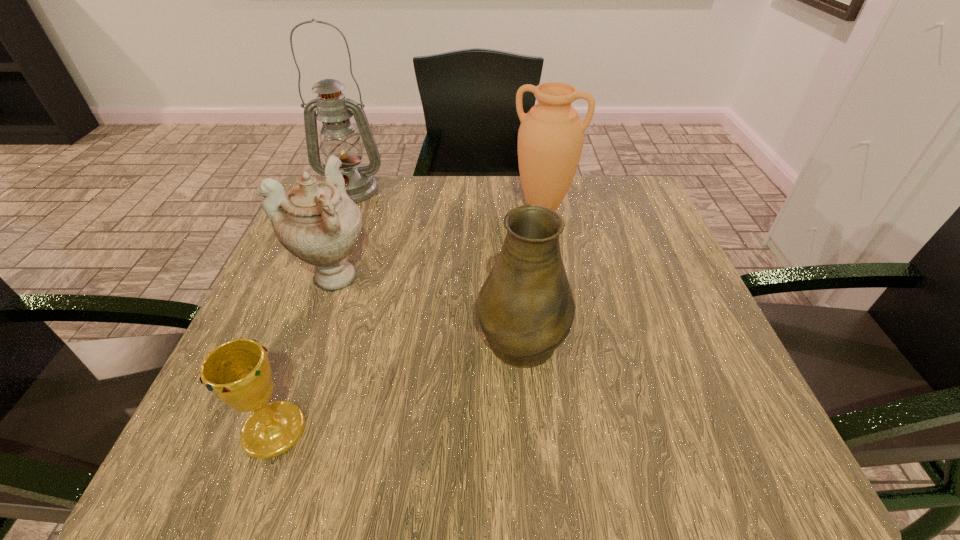
You are a GUI agent. You are given a task and a screenshot of the screen. Output one action in this format:
    pyautogui.click(x=<x>, y=<y>)
    Task: Click on the vacant area that lies between the pitcher and the chalice
    
    Given the screenshot: What is the action you would take?
    pyautogui.click(x=398, y=383)

You are a GUI agent. You are given a task and a screenshot of the screen. Output one action in this format:
    pyautogui.click(x=<x>, y=<y>)
    Task: Click on the free space between the pitcher and the chalice
    The width and height of the screenshot is (960, 540).
    Given the screenshot: What is the action you would take?
    pyautogui.click(x=398, y=383)

At what (x,y) coordinates should I click in order to perform the action: click on free space between the pitcher and the nearer urn. Please return your answer as a coordinate pair (x, y). Looking at the image, I should click on (428, 306).

Where is `free space between the nearer urn and the pitcher`? The height and width of the screenshot is (540, 960). free space between the nearer urn and the pitcher is located at coordinates (428, 306).

I want to click on empty location between the nearest object and the tallest object, so click(313, 310).

I want to click on free space between the nearer urn and the right urn, so tap(439, 242).

Image resolution: width=960 pixels, height=540 pixels. I want to click on object that ranks as the fourth closest to the pitcher, so click(339, 137).

Select which object appears as the fourth closest to the pitcher. Please provide its 2D coordinates. Your answer should be formatted as a tuple, i.e. [(x, y)], where the tuple contains the x and y coordinates of a point satisfying the conditions above.

[(339, 137)]

This screenshot has height=540, width=960. Find the location of `free space that satisfies the following two spatial constraints: 1. on the handle side of the taller urn; 2. on the left side of the pitcher`. free space that satisfies the following two spatial constraints: 1. on the handle side of the taller urn; 2. on the left side of the pitcher is located at coordinates (511, 207).

Where is `vacant space that satisfies the following two spatial constraints: 1. on the back side of the shorter urn; 2. on the left side of the nearest object`? The image size is (960, 540). vacant space that satisfies the following two spatial constraints: 1. on the back side of the shorter urn; 2. on the left side of the nearest object is located at coordinates (330, 276).